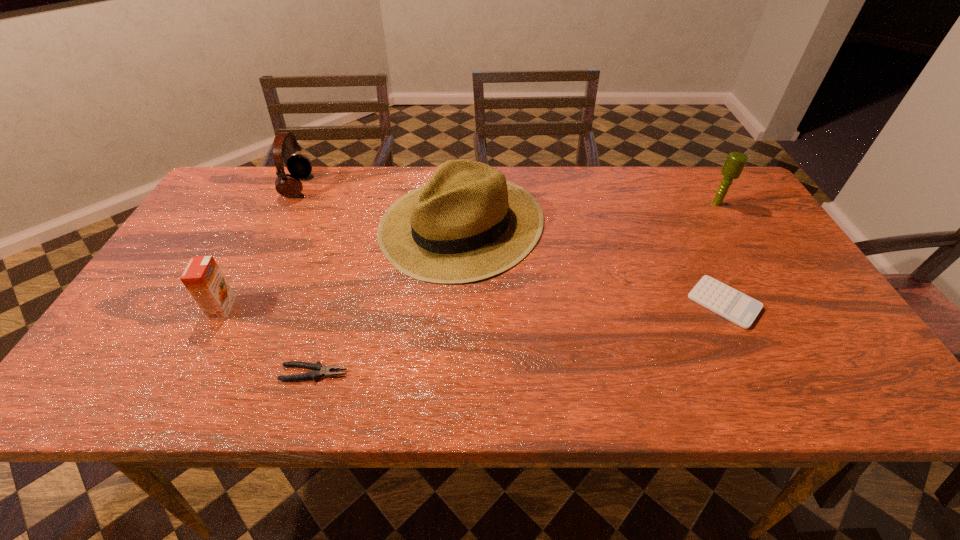
The width and height of the screenshot is (960, 540). I want to click on headset, so click(299, 166).

This screenshot has height=540, width=960. Identify the location of sunhat. (468, 223).

This screenshot has height=540, width=960. I want to click on the rightmost object, so click(735, 162).

Locate an element on the screen. The height and width of the screenshot is (540, 960). the fourth tallest object is located at coordinates (202, 277).

I want to click on pliers, so click(318, 370).

The image size is (960, 540). I want to click on the fifth tallest object, so click(318, 370).

At what (x,y) coordinates should I click in order to perform the action: click on the shortest object. Please return your answer as a coordinate pair (x, y). Looking at the image, I should click on (737, 307).

Where is `the fifth object from left to right`? the fifth object from left to right is located at coordinates (737, 307).

Locate an element on the screen. free location located on the ear pads of the headset is located at coordinates (333, 186).

What are the coordinates of `vacant region located on the left of the sunhat` in the screenshot? It's located at (264, 224).